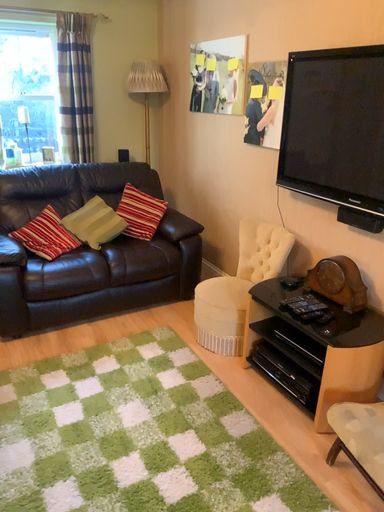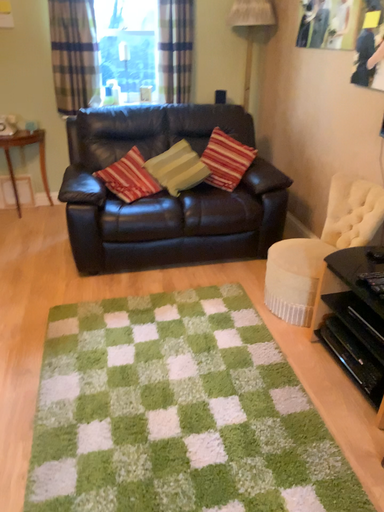
Question: How did the camera likely rotate when shooting the video?

Choices:
 (A) rotated right
 (B) rotated left

Answer: (B)